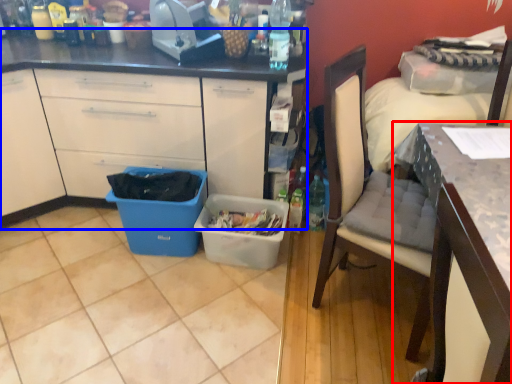
Question: Which object appears closest to the camera in this image, desk (highlighted by a red box) or cabinetry (highlighted by a blue box)?

Choices:
 (A) desk
 (B) cabinetry

Answer: (A)